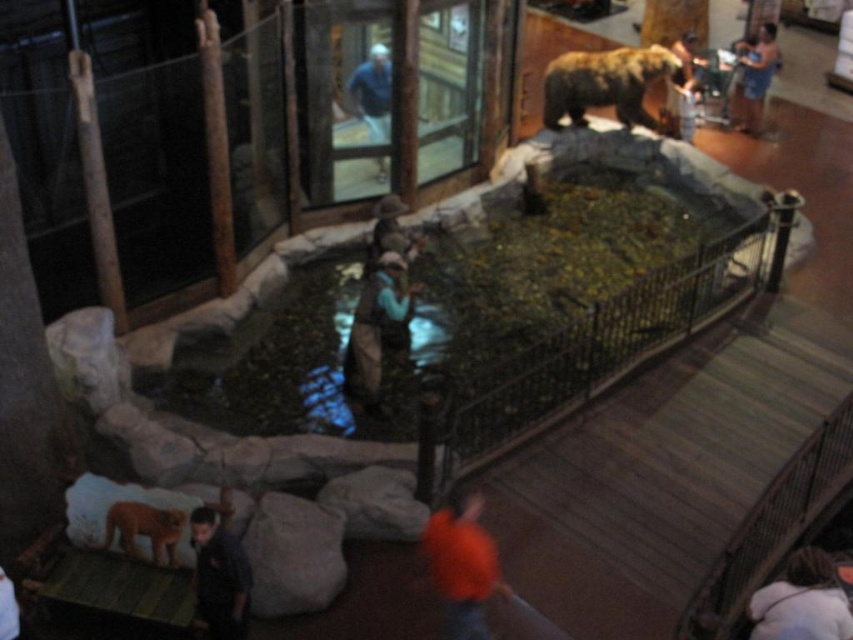
You are standing at the entrance of the exhibit and want to take a photo of the bear without any people in the frame. There is an orange fabric shirt at lower center in the image. Where should you position yourself to avoid blocking the view of the bear?

Since the orange fabric shirt at lower center is located at point (462,563), you should position yourself to the left or right of this point to avoid blocking the view of the bear.

You are a visitor at the exhibit and want to take a photo of the bear without any people in the frame. You notice the blue denim jacket at upper center and the denim shorts at upper right are blocking your view. Which of the two is shorter so you can crouch behind it to avoid being seen?

The blue denim jacket at upper center is shorter than the denim shorts at upper right, so you can crouch behind the blue denim jacket at upper center to avoid being seen.